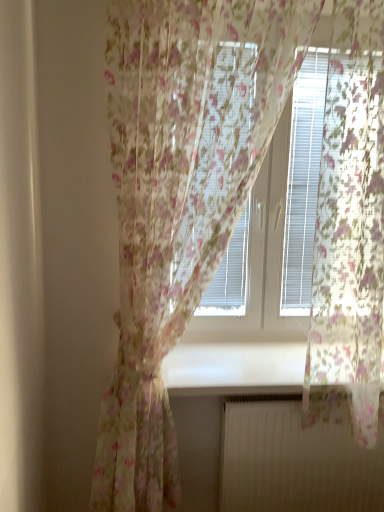
Question: From a real-world perspective, is white plastic blinds at upper center positioned over white matte radiator at lower center based on gravity?

Choices:
 (A) no
 (B) yes

Answer: (B)

Question: Is white matte radiator at lower center a part of white plastic blinds at upper center?

Choices:
 (A) yes
 (B) no

Answer: (B)

Question: Is white plastic blinds at upper center shorter than white matte radiator at lower center?

Choices:
 (A) yes
 (B) no

Answer: (B)

Question: From a real-world perspective, is white plastic blinds at upper center located beneath white matte radiator at lower center?

Choices:
 (A) no
 (B) yes

Answer: (A)

Question: Is white plastic blinds at upper center oriented towards white matte radiator at lower center?

Choices:
 (A) yes
 (B) no

Answer: (B)

Question: From the image's perspective, would you say white plastic blinds at upper center is positioned over white matte radiator at lower center?

Choices:
 (A) no
 (B) yes

Answer: (B)

Question: From a real-world perspective, does white matte radiator at lower center sit lower than white plastic blinds at upper center?

Choices:
 (A) no
 (B) yes

Answer: (B)

Question: Does white matte radiator at lower center lie behind white plastic blinds at upper center?

Choices:
 (A) yes
 (B) no

Answer: (A)

Question: Does white matte radiator at lower center have a lesser height compared to white plastic blinds at upper center?

Choices:
 (A) no
 (B) yes

Answer: (B)

Question: Could you tell me if white matte radiator at lower center is turned towards white plastic blinds at upper center?

Choices:
 (A) yes
 (B) no

Answer: (B)

Question: Does white matte radiator at lower center have a greater height compared to white plastic blinds at upper center?

Choices:
 (A) yes
 (B) no

Answer: (B)

Question: Are white matte radiator at lower center and white plastic blinds at upper center far apart?

Choices:
 (A) no
 (B) yes

Answer: (A)

Question: From a real-world perspective, is white matte radiator at lower center over white glossy window sill at center?

Choices:
 (A) no
 (B) yes

Answer: (A)